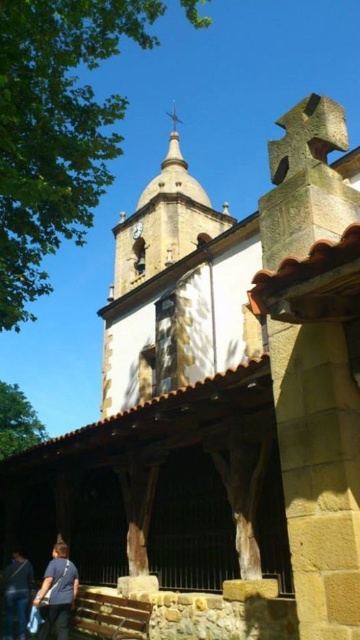
Between point (167, 180) and point (3, 572), which one is positioned behind?

The point (167, 180) is behind.

Does smooth beige steeple at upper center have a greater height compared to blue denim jeans at lower left?

Yes, smooth beige steeple at upper center is taller than blue denim jeans at lower left.

Locate an element on the screen. smooth beige steeple at upper center is located at coordinates (164, 221).

Is smooth beige steeple at upper center shorter than white glossy clock at upper center?

Incorrect, smooth beige steeple at upper center's height does not fall short of white glossy clock at upper center's.

Which is below, smooth beige steeple at upper center or white glossy clock at upper center?

white glossy clock at upper center is below.

What are the coordinates of `smooth beige steeple at upper center` in the screenshot? It's located at (164, 221).

Does blue denim jeans at lower left have a larger size compared to white glossy clock at upper center?

Incorrect, blue denim jeans at lower left is not larger than white glossy clock at upper center.

Based on the photo, does blue denim jeans at lower left have a lesser height compared to white glossy clock at upper center?

Indeed, blue denim jeans at lower left has a lesser height compared to white glossy clock at upper center.

Which is in front, point (6, 595) or point (141, 227)?

Point (6, 595)

Identify the location of blue denim jeans at lower left. (16, 595).